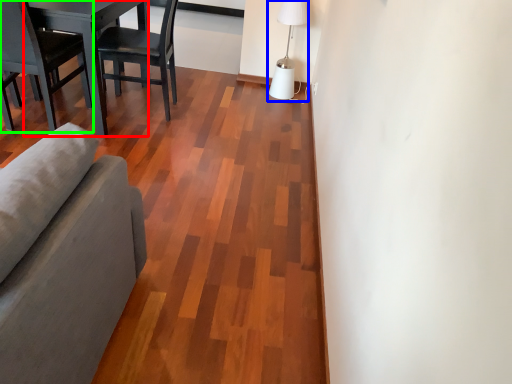
Question: Estimate the real-world distances between objects in this image. Which object is closer to table (highlighted by a red box), table lamp (highlighted by a blue box) or chair (highlighted by a green box)?

Choices:
 (A) table lamp
 (B) chair

Answer: (B)